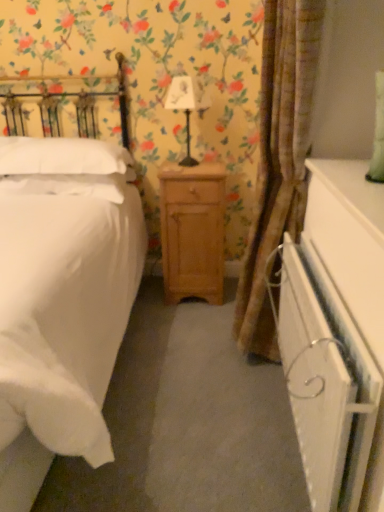
Image resolution: width=384 pixels, height=512 pixels. I want to click on white soft pillow at left, which is the first pillow in bottom-to-top order, so click(x=68, y=185).

Identify the location of white fabric lampshade at center. (185, 106).

Locate an element on the screen. The image size is (384, 512). white matte bed at left is located at coordinates (62, 321).

At what (x,y) coordinates should I click in order to perform the action: click on light brown wood nightstand at center. Please return your answer as a coordinate pair (x, y). This screenshot has width=384, height=512. Looking at the image, I should click on (192, 231).

Is brown textured curtain at center taller or shorter than white soft pillow at left, which is the first pillow in bottom-to-top order?

brown textured curtain at center is taller than white soft pillow at left, which is the first pillow in bottom-to-top order.

Are brown textured curtain at center and white soft pillow at left, positioned as the 2th pillow in top-to-bottom order, far apart?

No, there isn't a large distance between brown textured curtain at center and white soft pillow at left, positioned as the 2th pillow in top-to-bottom order.

Is point (276, 20) farther from viewer compared to point (71, 180)?

That is False.

Locate an element on the screen. curtain in front of the white soft pillow at left, positioned as the 2th pillow in top-to-bottom order is located at coordinates (279, 158).

Is white glossy dresser at lower right behind white fabric lampshade at center?

That is False.

Which of these two, white glossy dresser at lower right or white fabric lampshade at center, is thinner?

With smaller width is white glossy dresser at lower right.

You are a GUI agent. You are given a task and a screenshot of the screen. Output one action in this format:
    pyautogui.click(x=<x>, y=<y>)
    Task: Click on the dresser below the white fabric lampshade at center (from the image's perspective)
    This screenshot has width=384, height=512.
    Given the screenshot: What is the action you would take?
    pyautogui.click(x=335, y=330)

Is white glossy dresser at lower right not within white fabric lampshade at center?

Absolutely, white glossy dresser at lower right is external to white fabric lampshade at center.

Based on their sizes in the image, would you say white matte bed at left is bigger or smaller than white fabric lampshade at center?

white matte bed at left is bigger than white fabric lampshade at center.

Based on the photo, is white matte bed at left far from white fabric lampshade at center?

No, white matte bed at left is not far away from white fabric lampshade at center.

What are the coordinates of `bed on the left of white fabric lampshade at center` in the screenshot? It's located at (62, 321).

From the image's perspective, which one is positioned higher, light brown wood nightstand at center or white soft pillow at left, positioned as the 2th pillow in top-to-bottom order?

From the image's view, white soft pillow at left, positioned as the 2th pillow in top-to-bottom order, is above.

Is light brown wood nightstand at center completely or partially outside of white soft pillow at left, which is the first pillow in bottom-to-top order?

Yes, light brown wood nightstand at center is outside of white soft pillow at left, which is the first pillow in bottom-to-top order.

Does light brown wood nightstand at center appear on the right side of white soft pillow at left, which is the first pillow in bottom-to-top order?

Correct, you'll find light brown wood nightstand at center to the right of white soft pillow at left, which is the first pillow in bottom-to-top order.

Is light brown wood nightstand at center facing towards white soft pillow at left, positioned as the 2th pillow in top-to-bottom order?

No, light brown wood nightstand at center is not facing towards white soft pillow at left, positioned as the 2th pillow in top-to-bottom order.

Does white soft pillow at left, which is the 1th pillow from top to bottom, come in front of white glossy dresser at lower right?

No, white soft pillow at left, which is the 1th pillow from top to bottom, is further to the viewer.

Is white glossy dresser at lower right completely or partially inside white soft pillow at left, which ranks as the 2th pillow in bottom-to-top order?

No, white glossy dresser at lower right is located outside of white soft pillow at left, which ranks as the 2th pillow in bottom-to-top order.

Considering the sizes of white soft pillow at left, which is the 1th pillow from top to bottom, and white glossy dresser at lower right in the image, is white soft pillow at left, which is the 1th pillow from top to bottom, bigger or smaller than white glossy dresser at lower right?

Considering their sizes, white soft pillow at left, which is the 1th pillow from top to bottom, takes up more space than white glossy dresser at lower right.

From the image's perspective, between white soft pillow at left, which is the 1th pillow from top to bottom, and white glossy dresser at lower right, who is located below?

From the image's view, white glossy dresser at lower right is below.

Consider the image. How many degrees apart are the facing directions of white soft pillow at left, which is the first pillow in bottom-to-top order, and white fabric lampshade at center?

The angular difference between white soft pillow at left, which is the first pillow in bottom-to-top order, and white fabric lampshade at center is 27.1 degrees.

Is white soft pillow at left, which is the first pillow in bottom-to-top order, positioned with its back to white fabric lampshade at center?

No, white soft pillow at left, which is the first pillow in bottom-to-top order, is not facing the opposite direction of white fabric lampshade at center.

Considering the sizes of objects white soft pillow at left, positioned as the 2th pillow in top-to-bottom order, and white fabric lampshade at center in the image provided, who is shorter, white soft pillow at left, positioned as the 2th pillow in top-to-bottom order, or white fabric lampshade at center?

Standing shorter between the two is white soft pillow at left, positioned as the 2th pillow in top-to-bottom order.

Is white soft pillow at left, positioned as the 2th pillow in top-to-bottom order, not inside white fabric lampshade at center?

Yes.

From the image's perspective, is white matte bed at left below white soft pillow at left, which is the first pillow in bottom-to-top order?

Yes.

Does point (36, 369) appear closer or farther from the camera than point (53, 182)?

Clearly, point (36, 369) is closer to the camera than point (53, 182).

Does white matte bed at left have a smaller size compared to white soft pillow at left, positioned as the 2th pillow in top-to-bottom order?

Actually, white matte bed at left might be larger than white soft pillow at left, positioned as the 2th pillow in top-to-bottom order.

What are the coordinates of `the 2nd pillow behind the white matte bed at left, starting your count from the anchor` in the screenshot? It's located at click(68, 185).

The width and height of the screenshot is (384, 512). I want to click on curtain that appears above the white soft pillow at left, which is the first pillow in bottom-to-top order (from a real-world perspective), so click(279, 158).

Identify the location of dresser in front of the white fabric lampshade at center. (335, 330).

Based on their spatial positions, is white fabric lampshade at center or light brown wood nightstand at center closer to white matte bed at left?

The object closer to white matte bed at left is light brown wood nightstand at center.

From the image, which object appears to be farther from white soft pillow at left, positioned as the 2th pillow in top-to-bottom order, white fabric lampshade at center or light brown wood nightstand at center?

white fabric lampshade at center is positioned further to the anchor white soft pillow at left, positioned as the 2th pillow in top-to-bottom order.

When comparing their distances from white soft pillow at left, positioned as the 2th pillow in top-to-bottom order, does white glossy dresser at lower right or light brown wood nightstand at center seem further?

white glossy dresser at lower right.

Looking at the image, which one is located further to white soft pillow at left, which is the first pillow in bottom-to-top order, brown textured curtain at center or white soft pillow at left, which ranks as the 2th pillow in bottom-to-top order?

The object further to white soft pillow at left, which is the first pillow in bottom-to-top order, is brown textured curtain at center.

Estimate the real-world distances between objects in this image. Which object is closer to white soft pillow at left, which ranks as the 2th pillow in bottom-to-top order, white matte bed at left or white soft pillow at left, which is the first pillow in bottom-to-top order?

Based on the image, white soft pillow at left, which is the first pillow in bottom-to-top order, appears to be nearer to white soft pillow at left, which ranks as the 2th pillow in bottom-to-top order.

Considering their positions, is white fabric lampshade at center positioned further to white soft pillow at left, which is the 1th pillow from top to bottom, than white soft pillow at left, positioned as the 2th pillow in top-to-bottom order?

Based on the image, white fabric lampshade at center appears to be further to white soft pillow at left, which is the 1th pillow from top to bottom.

Considering their positions, is white matte bed at left positioned closer to brown textured curtain at center than white soft pillow at left, positioned as the 2th pillow in top-to-bottom order?

white matte bed at left lies closer to brown textured curtain at center than the other object.

Which object lies nearer to the anchor point white fabric lampshade at center, white soft pillow at left, which is the first pillow in bottom-to-top order, or white glossy dresser at lower right?

white soft pillow at left, which is the first pillow in bottom-to-top order.

What are the coordinates of `pillow located between white soft pillow at left, which is the first pillow in bottom-to-top order, and white fabric lampshade at center in the left-right direction` in the screenshot? It's located at 61,156.

This screenshot has width=384, height=512. In order to click on dresser between white matte bed at left and light brown wood nightstand at center from front to back in this screenshot , I will do 335,330.

Image resolution: width=384 pixels, height=512 pixels. In order to click on curtain between white matte bed at left and white soft pillow at left, which ranks as the 2th pillow in bottom-to-top order, along the z-axis in this screenshot , I will do `click(279, 158)`.

Where is `curtain between white glossy dresser at lower right and white fabric lampshade at center in the front-back direction`? The image size is (384, 512). curtain between white glossy dresser at lower right and white fabric lampshade at center in the front-back direction is located at coordinates (279, 158).